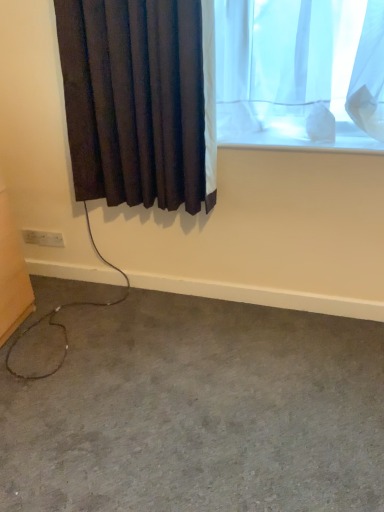
Question: Considering the relative sizes of dark fabric curtain at left and white plastic electric outlet at lower left in the image provided, is dark fabric curtain at left taller than white plastic electric outlet at lower left?

Choices:
 (A) yes
 (B) no

Answer: (A)

Question: From the image's perspective, does dark fabric curtain at left appear higher than white plastic electric outlet at lower left?

Choices:
 (A) yes
 (B) no

Answer: (A)

Question: Does dark fabric curtain at left have a smaller size compared to white plastic electric outlet at lower left?

Choices:
 (A) no
 (B) yes

Answer: (A)

Question: Can you confirm if dark fabric curtain at left is bigger than white plastic electric outlet at lower left?

Choices:
 (A) no
 (B) yes

Answer: (B)

Question: Is dark fabric curtain at left at the right side of white plastic electric outlet at lower left?

Choices:
 (A) no
 (B) yes

Answer: (B)

Question: Considering the positions of point (155, 362) and point (46, 236), is point (155, 362) closer or farther from the camera than point (46, 236)?

Choices:
 (A) closer
 (B) farther

Answer: (A)

Question: From the image's perspective, is gray carpet at lower left located above or below white plastic electric outlet at lower left?

Choices:
 (A) above
 (B) below

Answer: (B)

Question: From a real-world perspective, is gray carpet at lower left physically located above or below white plastic electric outlet at lower left?

Choices:
 (A) below
 (B) above

Answer: (A)

Question: Is gray carpet at lower left inside the boundaries of white plastic electric outlet at lower left, or outside?

Choices:
 (A) inside
 (B) outside

Answer: (B)

Question: Considering the positions of gray carpet at lower left and dark fabric curtain at left in the image, is gray carpet at lower left wider or thinner than dark fabric curtain at left?

Choices:
 (A) wide
 (B) thin

Answer: (A)

Question: In terms of size, does gray carpet at lower left appear bigger or smaller than dark fabric curtain at left?

Choices:
 (A) small
 (B) big

Answer: (B)

Question: From their relative heights in the image, would you say gray carpet at lower left is taller or shorter than dark fabric curtain at left?

Choices:
 (A) tall
 (B) short

Answer: (B)

Question: Considering the relative positions of gray carpet at lower left and dark fabric curtain at left in the image provided, is gray carpet at lower left to the left or to the right of dark fabric curtain at left?

Choices:
 (A) left
 (B) right

Answer: (B)

Question: Would you say white plastic electric outlet at lower left is inside or outside dark fabric curtain at left?

Choices:
 (A) outside
 (B) inside

Answer: (A)

Question: Looking at the image, does white plastic electric outlet at lower left seem bigger or smaller compared to dark fabric curtain at left?

Choices:
 (A) big
 (B) small

Answer: (B)